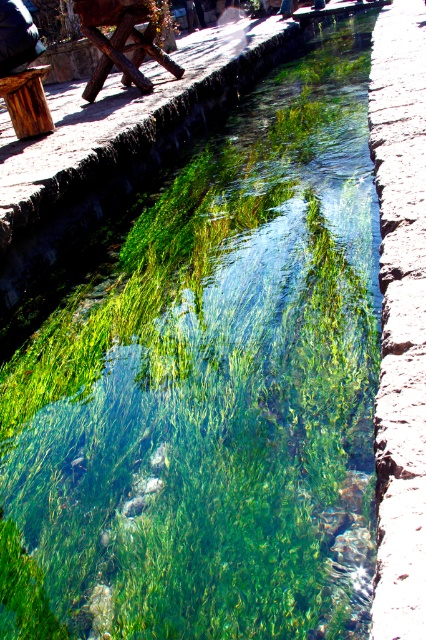
Question: Is wooden picnic table at upper left behind wooden stool at upper left?

Choices:
 (A) yes
 (B) no

Answer: (A)

Question: Among these objects, which one is nearest to the camera?

Choices:
 (A) wooden stool at upper left
 (B) wooden picnic table at upper left

Answer: (A)

Question: Where is wooden picnic table at upper left located in relation to wooden stool at upper left in the image?

Choices:
 (A) below
 (B) above

Answer: (B)

Question: Which point is closer to the camera?

Choices:
 (A) wooden picnic table at upper left
 (B) wooden stool at upper left

Answer: (B)

Question: Among these points, which one is farthest from the camera?

Choices:
 (A) (23, 116)
 (B) (149, 92)

Answer: (B)

Question: Can you confirm if wooden picnic table at upper left is thinner than wooden stool at upper left?

Choices:
 (A) no
 (B) yes

Answer: (A)